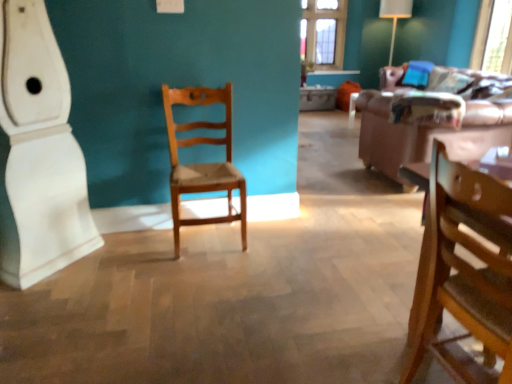
Question: Based on their positions, is brown leather couch at right located to the left or right of wooden chair at right, positioned as the 1th chair in front-to-back order?

Choices:
 (A) right
 (B) left

Answer: (A)

Question: From their relative heights in the image, would you say brown leather couch at right is taller or shorter than wooden chair at right, positioned as the 1th chair in front-to-back order?

Choices:
 (A) tall
 (B) short

Answer: (B)

Question: Which of these objects is positioned farthest from the transparent glass window screen at upper right?

Choices:
 (A) brown leather couch at right
 (B) white glossy baseboard at left
 (C) natural wood chair at center, which is counted as the first chair, starting from the left
 (D) wooden chair at right, marked as the second chair in a back-to-front arrangement

Answer: (B)

Question: Which object is the farthest from the transparent glass window screen at upper right?

Choices:
 (A) white glossy baseboard at left
 (B) brown leather couch at right
 (C) wooden chair at right, marked as the second chair in a back-to-front arrangement
 (D) natural wood chair at center, marked as the second chair in a front-to-back arrangement

Answer: (A)